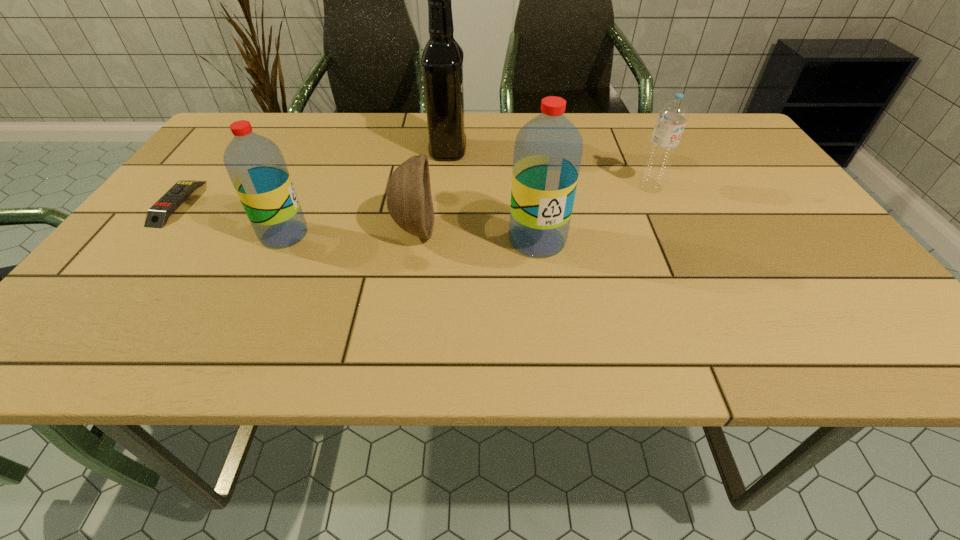
In the image, there is a desktop. Where is `free space at the near left corner`? Image resolution: width=960 pixels, height=540 pixels. free space at the near left corner is located at coordinates (91, 305).

I want to click on vacant space at the far right corner of the desktop, so click(686, 133).

Locate an element on the screen. Image resolution: width=960 pixels, height=540 pixels. vacant area at the near right corner is located at coordinates (801, 300).

Find the location of `free point between the tallest object and the fifth object from left to right`. free point between the tallest object and the fifth object from left to right is located at coordinates (492, 195).

Where is `vacant space that's between the leftmost object and the liquor`? The height and width of the screenshot is (540, 960). vacant space that's between the leftmost object and the liquor is located at coordinates (313, 177).

Locate an element on the screen. The image size is (960, 540). free space between the leftmost water bottle and the farthest object is located at coordinates (366, 192).

Locate an element on the screen. Image resolution: width=960 pixels, height=540 pixels. vacant space in between the remote control and the leftmost water bottle is located at coordinates (230, 219).

Locate an element on the screen. vacant area that lies between the leftmost water bottle and the shortest object is located at coordinates (230, 219).

Identify the location of empty space between the fifth object from left to right and the rightmost water bottle. Image resolution: width=960 pixels, height=540 pixels. (594, 213).

At what (x,y) coordinates should I click in order to perform the action: click on free space between the second object from left to right and the fifth tallest object. Please return your answer as a coordinate pair (x, y). Looking at the image, I should click on (349, 232).